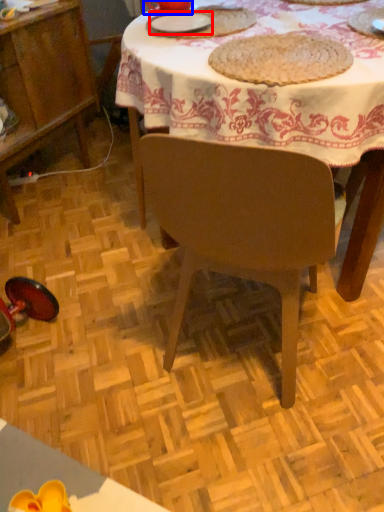
Question: Which object appears closest to the camera in this image, tableware (highlighted by a red box) or tableware (highlighted by a blue box)?

Choices:
 (A) tableware
 (B) tableware

Answer: (A)